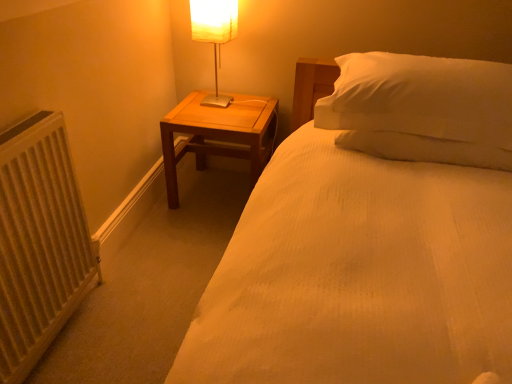
What do you see at coordinates (219, 134) in the screenshot? Image resolution: width=512 pixels, height=384 pixels. I see `wooden nightstand at center` at bounding box center [219, 134].

You are a GUI agent. You are given a task and a screenshot of the screen. Output one action in this format:
    pyautogui.click(x=<x>, y=<y>)
    Task: Click on the white fabric-covered lamp at upper left
    This screenshot has width=512, height=384.
    Given the screenshot: What is the action you would take?
    pyautogui.click(x=214, y=35)

In the image, is white fabric-covered lamp at upper left on the left side or the right side of wooden nightstand at center?

white fabric-covered lamp at upper left is positioned on wooden nightstand at center's left side.

From the image's perspective, is white fabric-covered lamp at upper left located above or below wooden nightstand at center?

Based on their image positions, white fabric-covered lamp at upper left is located above wooden nightstand at center.

Image resolution: width=512 pixels, height=384 pixels. Find the location of `table lamp lying in front of the wooden nightstand at center`. table lamp lying in front of the wooden nightstand at center is located at coordinates (214, 35).

Is wooden nightstand at center located within white fabric-covered lamp at upper left?

No, wooden nightstand at center is located outside of white fabric-covered lamp at upper left.

Can we say white textured radiator at left lies outside white fabric-covered lamp at upper left?

That's correct, white textured radiator at left is outside of white fabric-covered lamp at upper left.

Is point (88, 270) closer to camera compared to point (200, 36)?

Yes, it is.

Who is smaller, white textured radiator at left or white fabric-covered lamp at upper left?

white fabric-covered lamp at upper left.

Could wooden nightstand at center be considered to be inside white textured radiator at left?

No, wooden nightstand at center is not surrounded by white textured radiator at left.

From a real-world perspective, is white textured radiator at left above or below wooden nightstand at center?

In terms of real-world spatial position, white textured radiator at left is above wooden nightstand at center.

How different are the orientations of white textured radiator at left and wooden nightstand at center in degrees?

91.2 degrees.

Which of these two, white textured radiator at left or wooden nightstand at center, is thinner?

With smaller width is white textured radiator at left.

Is wooden nightstand at center taller or shorter than white textured radiator at left?

Clearly, wooden nightstand at center is shorter compared to white textured radiator at left.

At what (x,y) coordinates should I click in order to perform the action: click on radiator located on the left of wooden nightstand at center. Please return your answer as a coordinate pair (x, y). The height and width of the screenshot is (384, 512). Looking at the image, I should click on (39, 242).

Is wooden nightstand at center far away from white textured radiator at left?

No, there isn't a large distance between wooden nightstand at center and white textured radiator at left.

From the image's perspective, which one is positioned lower, wooden nightstand at center or white textured radiator at left?

From the image's view, white textured radiator at left is below.

Does point (237, 140) come behind point (226, 7)?

No, it is in front of (226, 7).

Is wooden nightstand at center smaller than white fabric-covered lamp at upper left?

Actually, wooden nightstand at center might be larger than white fabric-covered lamp at upper left.

From a real-world perspective, is wooden nightstand at center under white fabric-covered lamp at upper left?

Yes.

Considering the sizes of objects wooden nightstand at center and white fabric-covered lamp at upper left in the image provided, who is thinner, wooden nightstand at center or white fabric-covered lamp at upper left?

white fabric-covered lamp at upper left is thinner.

Can you confirm if white fabric-covered lamp at upper left is smaller than white textured radiator at left?

Yes.

Between white fabric-covered lamp at upper left and white textured radiator at left, which one appears on the left side from the viewer's perspective?

white textured radiator at left is more to the left.

Is white fabric-covered lamp at upper left positioned beyond the bounds of white textured radiator at left?

That's correct, white fabric-covered lamp at upper left is outside of white textured radiator at left.

Identify the location of table lamp positioned vertically above the wooden nightstand at center (from a real-world perspective). Image resolution: width=512 pixels, height=384 pixels. (214, 35).

At what (x,y) coordinates should I click in order to perform the action: click on table lamp on the right of white textured radiator at left. Please return your answer as a coordinate pair (x, y). Image resolution: width=512 pixels, height=384 pixels. Looking at the image, I should click on 214,35.

Estimate the real-world distances between objects in this image. Which object is closer to white fabric-covered lamp at upper left, wooden nightstand at center or white textured radiator at left?

Based on the image, wooden nightstand at center appears to be nearer to white fabric-covered lamp at upper left.

Estimate the real-world distances between objects in this image. Which object is further from white fabric-covered lamp at upper left, white textured radiator at left or wooden nightstand at center?

white textured radiator at left is positioned further to the anchor white fabric-covered lamp at upper left.

Looking at this image, based on their spatial positions, is white textured radiator at left or white fabric-covered lamp at upper left further from wooden nightstand at center?

Based on the image, white textured radiator at left appears to be further to wooden nightstand at center.

Looking at the image, which one is located further to wooden nightstand at center, white fabric-covered lamp at upper left or white textured radiator at left?

white textured radiator at left is further to wooden nightstand at center.

When comparing their distances from white textured radiator at left, does wooden nightstand at center or white fabric-covered lamp at upper left seem closer?

wooden nightstand at center is closer to white textured radiator at left.

Looking at the image, which one is located closer to white textured radiator at left, white fabric-covered lamp at upper left or wooden nightstand at center?

wooden nightstand at center is positioned closer to the anchor white textured radiator at left.

Where is `table lamp between white textured radiator at left and wooden nightstand at center from front to back`? This screenshot has width=512, height=384. table lamp between white textured radiator at left and wooden nightstand at center from front to back is located at coordinates (214, 35).